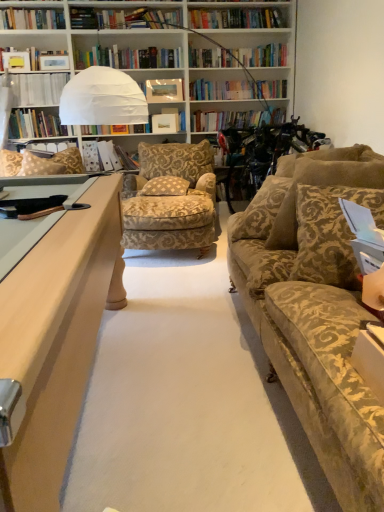
Identify the location of brown textured pillow at right, positioned as the fourth pillow in left-to-right order. The height and width of the screenshot is (512, 384). (321, 186).

The height and width of the screenshot is (512, 384). What do you see at coordinates (330, 234) in the screenshot?
I see `gold damask pillow at right, placed as the second pillow when sorted from right to left` at bounding box center [330, 234].

Identify the location of transparent plastic book at upper left, the second book in the right-to-left sequence. (38, 88).

Measure the distance between patterned fabric pillow at left, the 1th pillow in the back-to-front sequence, and camera.

The depth of patterned fabric pillow at left, the 1th pillow in the back-to-front sequence, is 10.66 feet.

You are a GUI agent. You are given a task and a screenshot of the screen. Output one action in this format:
    pyautogui.click(x=<x>, y=<y>)
    Task: Click on the patterned fabric pillow at left, the 4th pillow when ordered from right to left
    
    Given the screenshot: What is the action you would take?
    (x=39, y=166)

Locate an element on the screen. The height and width of the screenshot is (512, 384). brown textured pillow at right, which appears as the 2th pillow when viewed from the front is located at coordinates (321, 186).

Which is more to the right, brown textured pillow at right, the first pillow when ordered from right to left, or matte white folder at center, which appears as the 2th book when viewed from the top?

brown textured pillow at right, the first pillow when ordered from right to left.

Considering the sizes of brown textured pillow at right, the 3th pillow from the back, and matte white folder at center, which appears as the 2th book when viewed from the top, in the image, is brown textured pillow at right, the 3th pillow from the back, wider or thinner than matte white folder at center, which appears as the 2th book when viewed from the top,?

Clearly, brown textured pillow at right, the 3th pillow from the back, has more width compared to matte white folder at center, which appears as the 2th book when viewed from the top.

From a real-world perspective, is brown textured pillow at right, which appears as the 2th pillow when viewed from the front, on matte white folder at center, which appears as the 2th book when viewed from the top?

Yes, from a real-world perspective, brown textured pillow at right, which appears as the 2th pillow when viewed from the front, is above matte white folder at center, which appears as the 2th book when viewed from the top.

In the image, is brown textured pillow at right, positioned as the fourth pillow in left-to-right order, positioned in front of or behind matte white folder at center, which appears as the 2th book when viewed from the top?

brown textured pillow at right, positioned as the fourth pillow in left-to-right order, is positioned closer to the viewer than matte white folder at center, which appears as the 2th book when viewed from the top.

Which is more to the right, matte white photo frame at center or transparent plastic book at upper left, acting as the 1th book starting from the left?

From the viewer's perspective, matte white photo frame at center appears more on the right side.

Is matte white photo frame at center with transparent plastic book at upper left, the second book in the right-to-left sequence?

No.

How different are the orientations of matte white photo frame at center and transparent plastic book at upper left, the 1th book viewed from the top, in degrees?

matte white photo frame at center and transparent plastic book at upper left, the 1th book viewed from the top, are facing 6.22 degrees away from each other.

From the image's perspective, which one is positioned higher, matte white photo frame at center or transparent plastic book at upper left, which appears as the second book when ordered from the bottom?

matte white photo frame at center appears higher in the image.

Considering the positions of objects patterned fabric pillow at left, the 1th pillow when ordered from left to right, and brown textured pillow at right, the first pillow when ordered from right to left, in the image provided, who is more to the left, patterned fabric pillow at left, the 1th pillow when ordered from left to right, or brown textured pillow at right, the first pillow when ordered from right to left,?

patterned fabric pillow at left, the 1th pillow when ordered from left to right.

Which of these two, patterned fabric pillow at left, the 4th pillow when ordered from right to left, or brown textured pillow at right, the 3th pillow from the back, is wider?

Wider between the two is brown textured pillow at right, the 3th pillow from the back.

Where is `pillow that is the 2nd object located behind the brown textured pillow at right, positioned as the fourth pillow in left-to-right order`? Image resolution: width=384 pixels, height=512 pixels. pillow that is the 2nd object located behind the brown textured pillow at right, positioned as the fourth pillow in left-to-right order is located at coordinates (39, 166).

Is matte white folder at center, which ranks as the 1th book in bottom-to-top order, smaller than brown textured pillow at right, positioned as the fourth pillow in left-to-right order?

Yes.

In the scene shown: Is matte white folder at center, which appears as the 2th book when viewed from the top, situated inside brown textured pillow at right, positioned as the fourth pillow in left-to-right order, or outside?

matte white folder at center, which appears as the 2th book when viewed from the top, is not enclosed by brown textured pillow at right, positioned as the fourth pillow in left-to-right order.

From a real-world perspective, is matte white folder at center, which ranks as the 1th book in right-to-left order, beneath brown textured pillow at right, which appears as the 2th pillow when viewed from the front?

Yes, from a real-world perspective, matte white folder at center, which ranks as the 1th book in right-to-left order, is beneath brown textured pillow at right, which appears as the 2th pillow when viewed from the front.

Which point is more forward, (127, 161) or (317, 185)?

The point (317, 185) is in front.

From the image's perspective, between gold damask pillow at right, the 3th pillow positioned from the left, and patterned fabric pillow at center, the 3th pillow viewed from the right, who is located below?

gold damask pillow at right, the 3th pillow positioned from the left, from the image's perspective.

Which object is more forward, gold damask pillow at right, marked as the 4th pillow in a back-to-front arrangement, or patterned fabric pillow at center, the 3th pillow viewed from the right?

gold damask pillow at right, marked as the 4th pillow in a back-to-front arrangement, is closer to the camera.

Would you consider gold damask pillow at right, positioned as the first pillow in front-to-back order, to be distant from patterned fabric pillow at center, arranged as the 2th pillow when viewed from the left?

Yes, gold damask pillow at right, positioned as the first pillow in front-to-back order, is far from patterned fabric pillow at center, arranged as the 2th pillow when viewed from the left.

Between gold damask pillow at right, placed as the second pillow when sorted from right to left, and patterned fabric pillow at center, arranged as the 2th pillow when viewed from the back, which one has smaller size?

Smaller between the two is patterned fabric pillow at center, arranged as the 2th pillow when viewed from the back.

Is there a large distance between patterned fabric pillow at left, the 1th pillow when ordered from left to right, and gold damask pillow at right, the 3th pillow positioned from the left?

Absolutely, patterned fabric pillow at left, the 1th pillow when ordered from left to right, is distant from gold damask pillow at right, the 3th pillow positioned from the left.

From a real-world perspective, which is physically below, patterned fabric pillow at left, which is counted as the 4th pillow, starting from the front, or gold damask pillow at right, positioned as the first pillow in front-to-back order?

In real-world perspective, gold damask pillow at right, positioned as the first pillow in front-to-back order, is lower.

Does point (30, 159) appear closer or farther from the camera than point (299, 219)?

Point (30, 159) appears to be farther away from the viewer than point (299, 219).

You are a GUI agent. You are given a task and a screenshot of the screen. Output one action in this format:
    pyautogui.click(x=<x>, y=<y>)
    Task: Click on the 1st pillow in front of the patterned fabric pillow at center, arranged as the 2th pillow when viewed from the left
    
    Given the screenshot: What is the action you would take?
    pyautogui.click(x=321, y=186)

Between patterned fabric pillow at center, the 3th pillow viewed from the front, and brown textured pillow at right, which appears as the 2th pillow when viewed from the front, which one has smaller size?

Smaller between the two is patterned fabric pillow at center, the 3th pillow viewed from the front.

From the image's perspective, is patterned fabric pillow at center, arranged as the 2th pillow when viewed from the back, below brown textured pillow at right, positioned as the fourth pillow in left-to-right order?

Incorrect, from the image's perspective, patterned fabric pillow at center, arranged as the 2th pillow when viewed from the back, is higher than brown textured pillow at right, positioned as the fourth pillow in left-to-right order.

Can you see patterned fabric pillow at center, the 3th pillow viewed from the front, touching brown textured pillow at right, which appears as the 2th pillow when viewed from the front?

patterned fabric pillow at center, the 3th pillow viewed from the front, and brown textured pillow at right, which appears as the 2th pillow when viewed from the front, are not in contact.

Identify the location of book that appears below the brown textured pillow at right, which appears as the 2th pillow when viewed from the front (from a real-world perspective). (108, 157).

I want to click on paperback book behind the transparent plastic book at upper left, the 1th book viewed from the top, so click(164, 91).

From the image, which object appears to be nearer to patterned fabric pillow at left, the 4th pillow when ordered from right to left, brown textured pillow at right, positioned as the fourth pillow in left-to-right order, or matte white photo frame at center?

matte white photo frame at center lies closer to patterned fabric pillow at left, the 4th pillow when ordered from right to left, than the other object.

Considering their positions, is patterned fabric pillow at left, the 1th pillow in the back-to-front sequence, positioned closer to patterned fabric pillow at center, the 3th pillow viewed from the right, than brown textured pillow at right, positioned as the fourth pillow in left-to-right order?

Among the two, patterned fabric pillow at left, the 1th pillow in the back-to-front sequence, is located nearer to patterned fabric pillow at center, the 3th pillow viewed from the right.

Looking at the image, which one is located further to patterned fabric pillow at left, the 1th pillow when ordered from left to right, patterned fabric pillow at center, arranged as the 2th pillow when viewed from the back, or transparent plastic book at upper left, the 1th book viewed from the top?

transparent plastic book at upper left, the 1th book viewed from the top, lies further to patterned fabric pillow at left, the 1th pillow when ordered from left to right, than the other object.

Considering their positions, is matte white folder at center, which appears as the 2th book when viewed from the top, positioned closer to gold damask pillow at right, placed as the second pillow when sorted from right to left, than patterned fabric pillow at center, the 3th pillow viewed from the right?

patterned fabric pillow at center, the 3th pillow viewed from the right, lies closer to gold damask pillow at right, placed as the second pillow when sorted from right to left, than the other object.

When comparing their distances from transparent plastic book at upper left, acting as the 1th book starting from the left, does patterned fabric pillow at left, which is counted as the 4th pillow, starting from the front, or brown textured pillow at right, positioned as the fourth pillow in left-to-right order, seem closer?

Among the two, patterned fabric pillow at left, which is counted as the 4th pillow, starting from the front, is located nearer to transparent plastic book at upper left, acting as the 1th book starting from the left.

Looking at the image, which one is located further to patterned fabric pillow at center, arranged as the 2th pillow when viewed from the back, matte white photo frame at center or patterned fabric pillow at left, the 1th pillow in the back-to-front sequence?

matte white photo frame at center is positioned further to the anchor patterned fabric pillow at center, arranged as the 2th pillow when viewed from the back.

Estimate the real-world distances between objects in this image. Which object is closer to matte white folder at center, which ranks as the 1th book in bottom-to-top order, patterned fabric pillow at left, the 1th pillow in the back-to-front sequence, or patterned fabric pillow at center, arranged as the 2th pillow when viewed from the left?

patterned fabric pillow at left, the 1th pillow in the back-to-front sequence, lies closer to matte white folder at center, which ranks as the 1th book in bottom-to-top order, than the other object.

From the image, which object appears to be farther from patterned fabric pillow at left, which is counted as the 4th pillow, starting from the front, gold damask pillow at right, the 3th pillow positioned from the left, or patterned fabric pillow at center, arranged as the 2th pillow when viewed from the back?

gold damask pillow at right, the 3th pillow positioned from the left, lies further to patterned fabric pillow at left, which is counted as the 4th pillow, starting from the front, than the other object.

Identify the location of book between patterned fabric pillow at left, the 4th pillow when ordered from right to left, and matte white photo frame at center from left to right. click(108, 157).

Where is `book between transparent plastic book at upper left, the second book in the right-to-left sequence, and patterned fabric pillow at center, arranged as the 2th pillow when viewed from the left, from left to right`? book between transparent plastic book at upper left, the second book in the right-to-left sequence, and patterned fabric pillow at center, arranged as the 2th pillow when viewed from the left, from left to right is located at coordinates (108, 157).

Locate an element on the screen. The width and height of the screenshot is (384, 512). book between gold damask pillow at right, placed as the second pillow when sorted from right to left, and matte white folder at center, which appears as the 2th book when viewed from the top, along the z-axis is located at coordinates (38, 88).

Where is `book between transparent plastic book at upper left, acting as the 1th book starting from the left, and matte white photo frame at center from left to right`? The image size is (384, 512). book between transparent plastic book at upper left, acting as the 1th book starting from the left, and matte white photo frame at center from left to right is located at coordinates (108, 157).